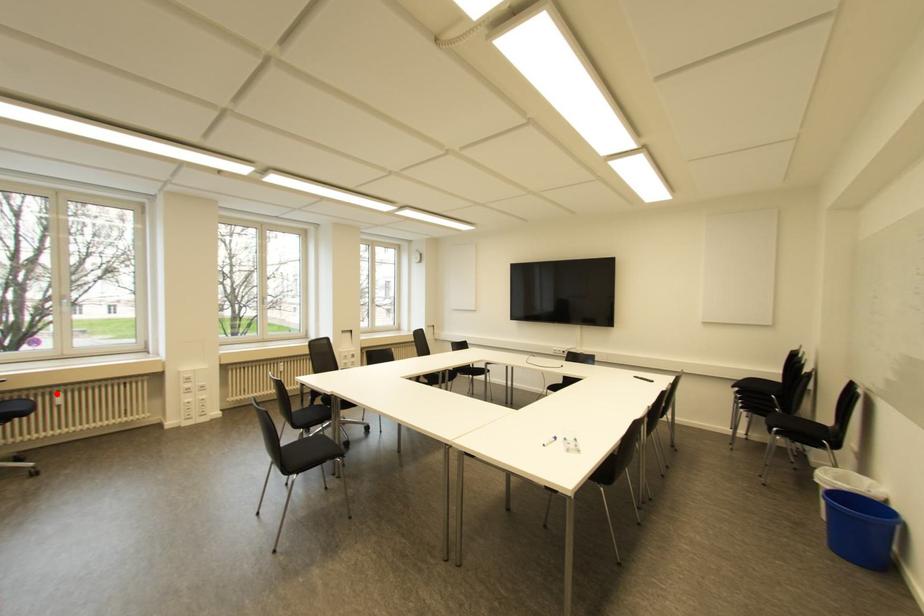
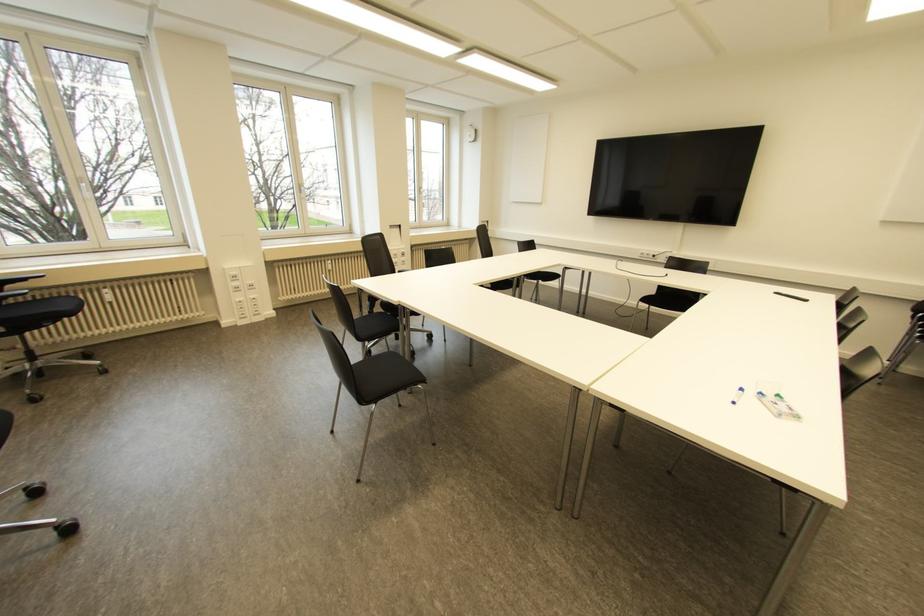
Find the pixel in the second image that matches the highlighted location in the first image.

(104, 290)